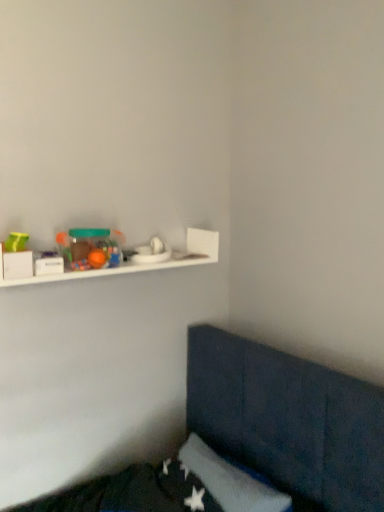
Question: Should I look upward or downward to see matte plastic container at upper left?

Choices:
 (A) down
 (B) up

Answer: (B)

Question: Does matte plastic container at upper left turn towards white matte shelf at upper left?

Choices:
 (A) no
 (B) yes

Answer: (B)

Question: Is matte plastic container at upper left completely or partially outside of white matte shelf at upper left?

Choices:
 (A) no
 (B) yes

Answer: (A)

Question: Can you confirm if matte plastic container at upper left is bigger than white matte shelf at upper left?

Choices:
 (A) yes
 (B) no

Answer: (B)

Question: From the image's perspective, does matte plastic container at upper left appear lower than white matte shelf at upper left?

Choices:
 (A) no
 (B) yes

Answer: (A)

Question: Is matte plastic container at upper left smaller than white matte shelf at upper left?

Choices:
 (A) yes
 (B) no

Answer: (A)

Question: Is white matte shelf at upper left inside matte plastic container at upper left?

Choices:
 (A) no
 (B) yes

Answer: (A)

Question: Can you see white matte shelf at upper left touching matte plastic container at upper left?

Choices:
 (A) yes
 (B) no

Answer: (B)

Question: Is white matte shelf at upper left behind matte plastic container at upper left?

Choices:
 (A) no
 (B) yes

Answer: (A)

Question: Is white matte shelf at upper left aimed at matte plastic container at upper left?

Choices:
 (A) yes
 (B) no

Answer: (A)

Question: Can you confirm if white matte shelf at upper left is positioned to the left of matte plastic container at upper left?

Choices:
 (A) no
 (B) yes

Answer: (A)

Question: Considering the relative sizes of white matte shelf at upper left and matte plastic container at upper left in the image provided, is white matte shelf at upper left bigger than matte plastic container at upper left?

Choices:
 (A) no
 (B) yes

Answer: (B)

Question: Can matte plastic container at upper left be found inside white matte shelf at upper left?

Choices:
 (A) no
 (B) yes

Answer: (B)

Question: Does point (165, 266) appear closer or farther from the camera than point (69, 249)?

Choices:
 (A) closer
 (B) farther

Answer: (B)